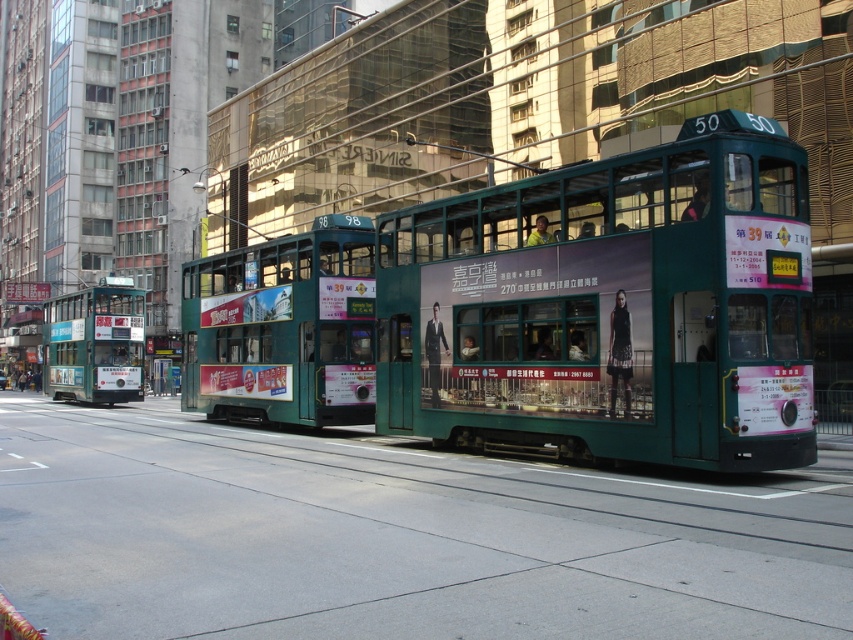
Question: Which of the following is the closest to the observer?

Choices:
 (A) green metallic tram at center
 (B) green metallic tram at left
 (C) green matte double-decker bus at center

Answer: (C)

Question: Which of these objects is positioned farthest from the green metallic tram at center?

Choices:
 (A) green metallic tram at left
 (B) green matte double-decker bus at center

Answer: (A)

Question: Is green matte double-decker bus at center above green metallic tram at left?

Choices:
 (A) yes
 (B) no

Answer: (A)

Question: Estimate the real-world distances between objects in this image. Which object is farther from the green metallic tram at left?

Choices:
 (A) green matte double-decker bus at center
 (B) green metallic tram at center

Answer: (A)

Question: Is the position of green matte double-decker bus at center more distant than that of green metallic tram at left?

Choices:
 (A) yes
 (B) no

Answer: (B)

Question: Observing the image, what is the correct spatial positioning of green matte double-decker bus at center in reference to green metallic tram at left?

Choices:
 (A) right
 (B) left

Answer: (A)